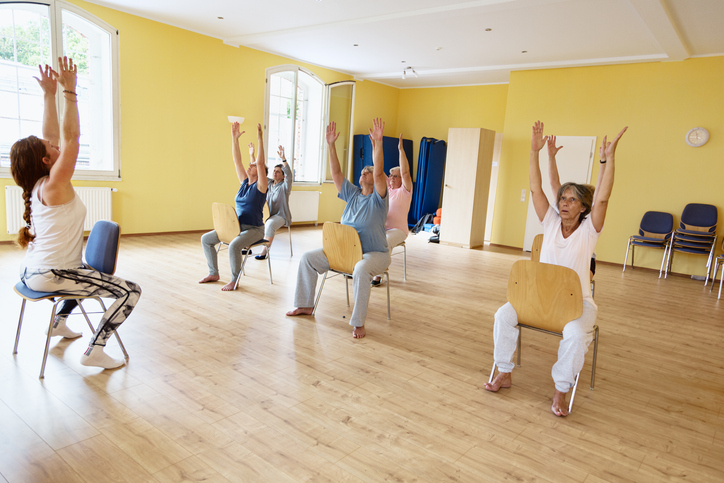
Where is `empty chairs`? Image resolution: width=724 pixels, height=483 pixels. empty chairs is located at coordinates (644, 238), (690, 249), (680, 241), (699, 238), (686, 227).